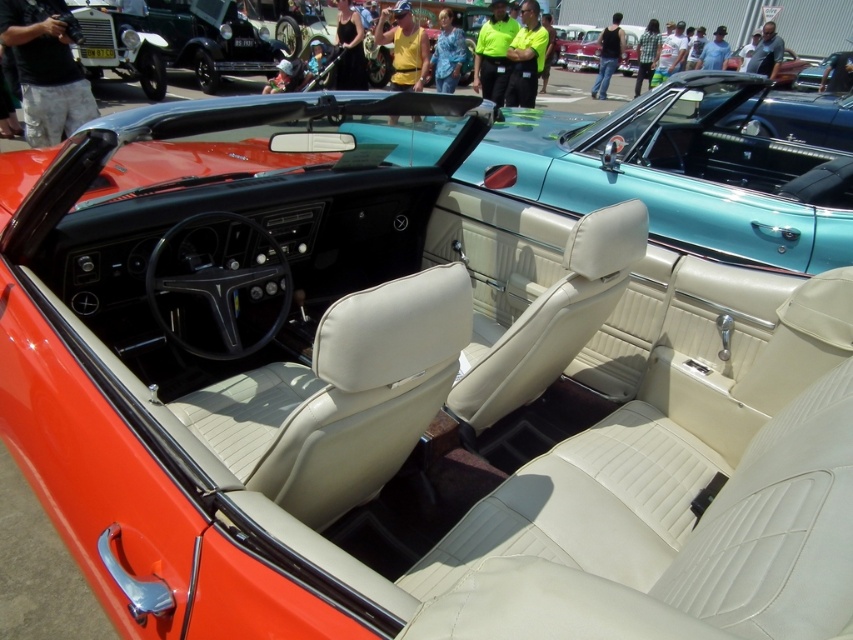
The image size is (853, 640). In order to click on matte black car at upper left in this screenshot , I will do `click(177, 42)`.

Describe the element at coordinates (177, 42) in the screenshot. I see `matte black car at upper left` at that location.

Which is behind, point (148, 45) or point (627, 60)?

The point (627, 60) is behind.

You are a GUI agent. You are given a task and a screenshot of the screen. Output one action in this format:
    pyautogui.click(x=<x>, y=<y>)
    Task: Click on the matte black car at upper left
    The height and width of the screenshot is (640, 853).
    Given the screenshot: What is the action you would take?
    pyautogui.click(x=177, y=42)